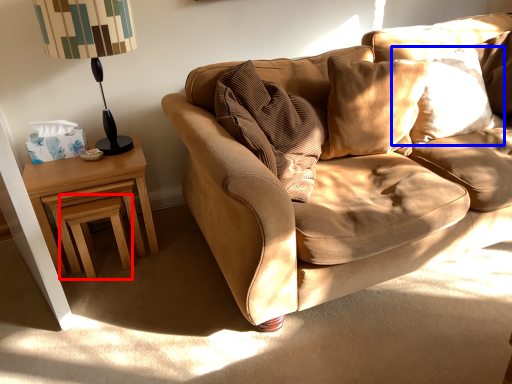
Question: Which point is further to the camera, stool (highlighted by a red box) or pillow (highlighted by a blue box)?

Choices:
 (A) stool
 (B) pillow

Answer: (B)